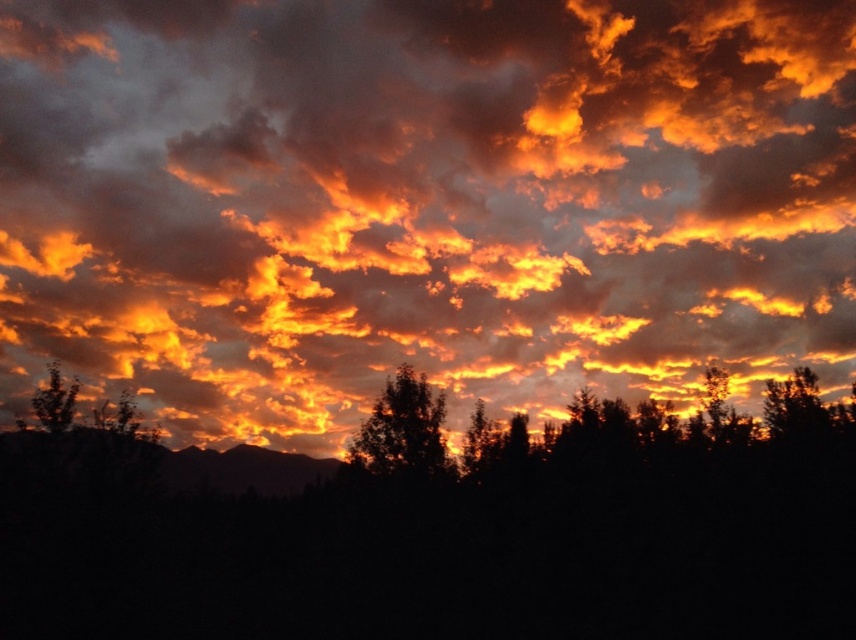
Consider the image. You are an astronomer observing the sunset scene. You notice the glowing orange cloud at upper center and the silhouette tree at center. Which object appears taller in the sky?

The glowing orange cloud at upper center appears taller than the silhouette tree at center because it has a greater height compared to it according to the description.